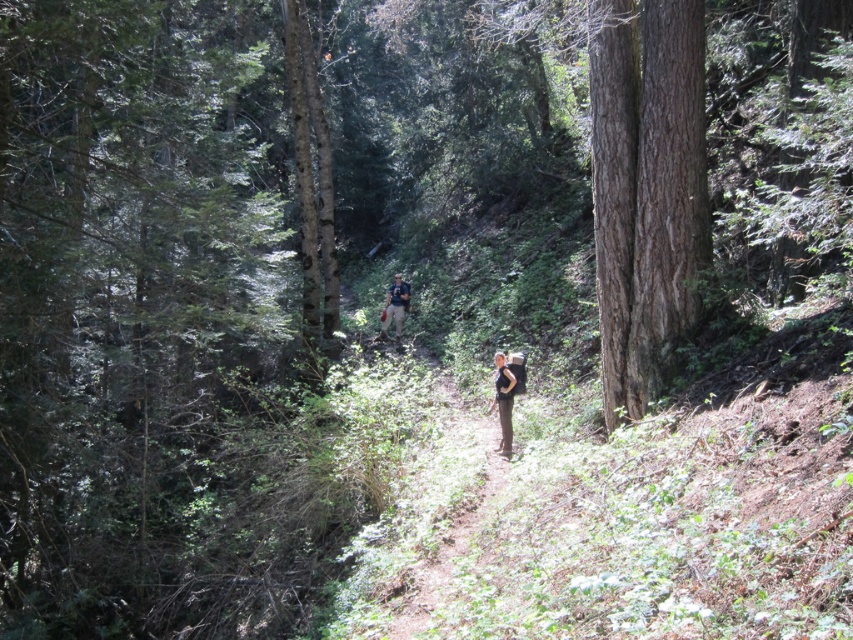
Question: Among these objects, which one is farthest from the camera?

Choices:
 (A) dark brown leather pants at center
 (B) smooth bark tree at center

Answer: (B)

Question: Does dark brown leather pants at center have a smaller size compared to camouflage fabric backpack at center?

Choices:
 (A) no
 (B) yes

Answer: (B)

Question: Which is nearer to the smooth bark tree at center?

Choices:
 (A) camouflage fabric backpack at center
 (B) dark brown leather pants at center

Answer: (A)

Question: Which of the following is the farthest from the observer?

Choices:
 (A) (312, 64)
 (B) (509, 412)

Answer: (A)

Question: Is smooth bark tree at center positioned before camouflage fabric backpack at center?

Choices:
 (A) no
 (B) yes

Answer: (B)

Question: Does smooth bark tree at center lie behind camouflage fabric backpack at center?

Choices:
 (A) no
 (B) yes

Answer: (A)